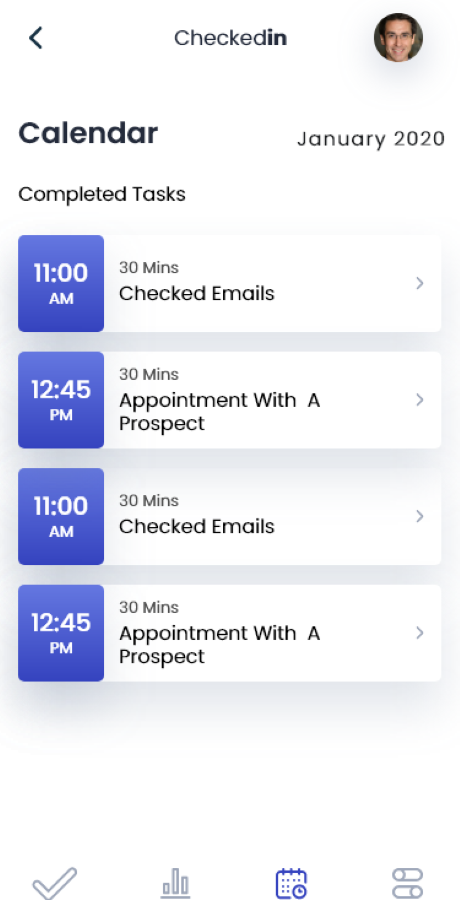
Locate an element on the screen. This screenshot has height=900, width=460. calendar is located at coordinates (292, 876).